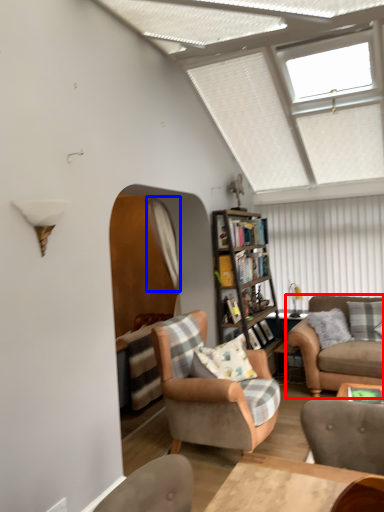
Question: Which point is further to the camera, studio couch (highlighted by a red box) or curtain (highlighted by a blue box)?

Choices:
 (A) studio couch
 (B) curtain

Answer: (B)